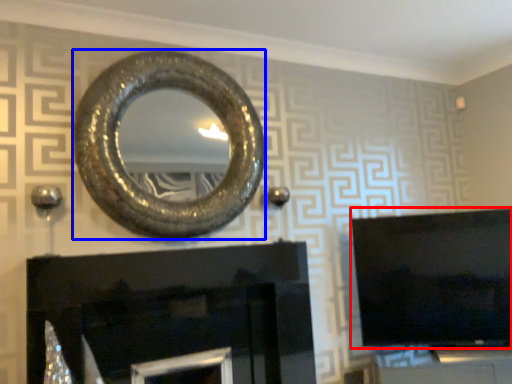
Question: Which object is closer to the camera taking this photo, television (highlighted by a red box) or oval (highlighted by a blue box)?

Choices:
 (A) television
 (B) oval

Answer: (B)